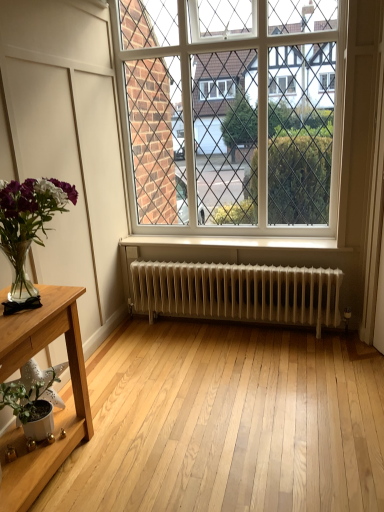
Question: From the image's perspective, would you say translucent glass vase at left, the first houseplant positioned from the top, is shown under white metallic radiator at center?

Choices:
 (A) no
 (B) yes

Answer: (A)

Question: Are translucent glass vase at left, the second houseplant when ordered from bottom to top, and white metallic radiator at center beside each other?

Choices:
 (A) yes
 (B) no

Answer: (B)

Question: Does translucent glass vase at left, the second houseplant when ordered from bottom to top, have a larger size compared to white metallic radiator at center?

Choices:
 (A) no
 (B) yes

Answer: (A)

Question: From a real-world perspective, is translucent glass vase at left, the first houseplant positioned from the top, on top of white metallic radiator at center?

Choices:
 (A) yes
 (B) no

Answer: (A)

Question: From the image's perspective, is translucent glass vase at left, the second houseplant when ordered from bottom to top, on white metallic radiator at center?

Choices:
 (A) yes
 (B) no

Answer: (A)

Question: Considering the relative sizes of translucent glass vase at left, the second houseplant when ordered from bottom to top, and white metallic radiator at center in the image provided, is translucent glass vase at left, the second houseplant when ordered from bottom to top, smaller than white metallic radiator at center?

Choices:
 (A) no
 (B) yes

Answer: (B)

Question: From the image's perspective, is translucent glass vase at left, the first houseplant positioned from the top, on light wood table at lower left?

Choices:
 (A) no
 (B) yes

Answer: (B)

Question: Does translucent glass vase at left, the first houseplant positioned from the top, have a greater height compared to light wood table at lower left?

Choices:
 (A) no
 (B) yes

Answer: (A)

Question: Can you confirm if translucent glass vase at left, the second houseplant when ordered from bottom to top, is wider than light wood table at lower left?

Choices:
 (A) no
 (B) yes

Answer: (B)

Question: Is translucent glass vase at left, the first houseplant positioned from the top, next to light wood table at lower left and touching it?

Choices:
 (A) yes
 (B) no

Answer: (B)

Question: Is translucent glass vase at left, the second houseplant when ordered from bottom to top, smaller than light wood table at lower left?

Choices:
 (A) yes
 (B) no

Answer: (A)

Question: Can you confirm if translucent glass vase at left, the second houseplant when ordered from bottom to top, is shorter than light wood table at lower left?

Choices:
 (A) yes
 (B) no

Answer: (A)

Question: Is white glass window at center oriented away from translucent glass vase at left, the second houseplant when ordered from bottom to top?

Choices:
 (A) yes
 (B) no

Answer: (B)